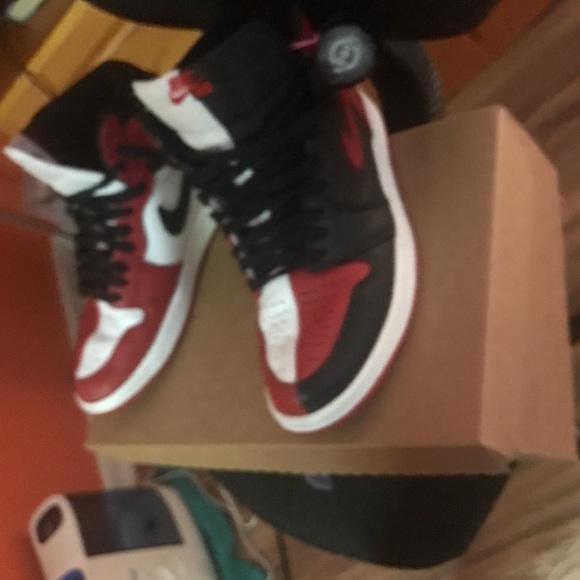
Where is `lid on box`? The height and width of the screenshot is (580, 580). lid on box is located at coordinates (466, 369).